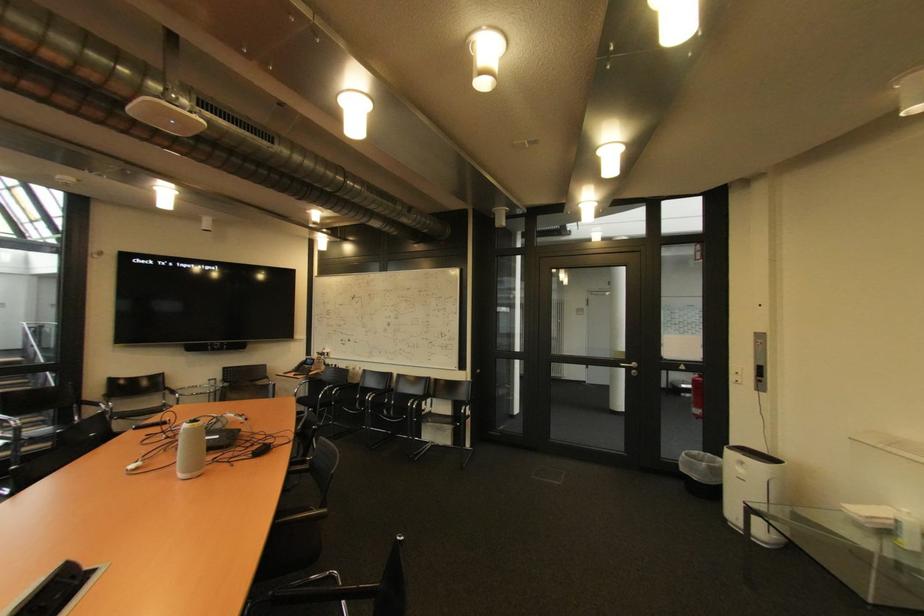
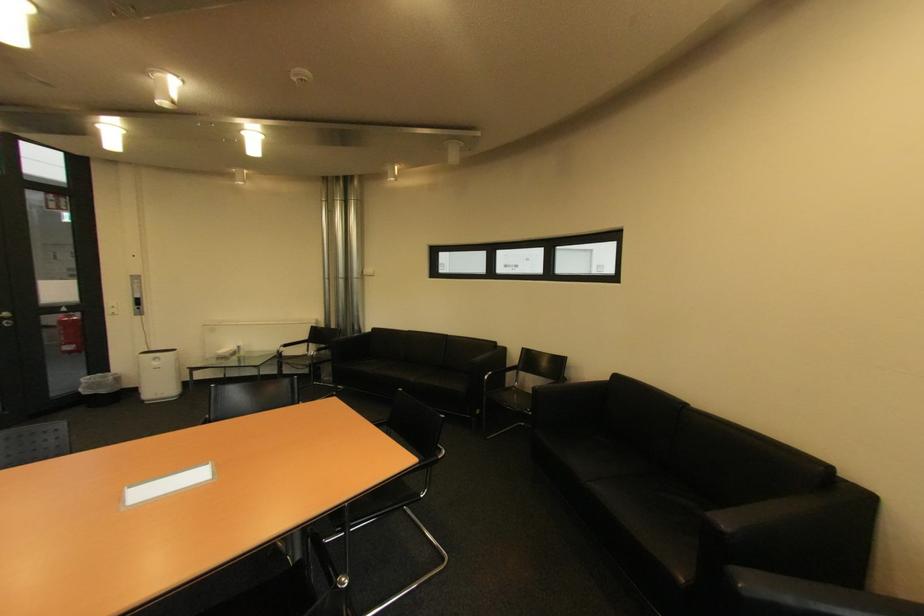
Where in the second image is the point corresponding to the point at 764,342 from the first image?

(140, 283)